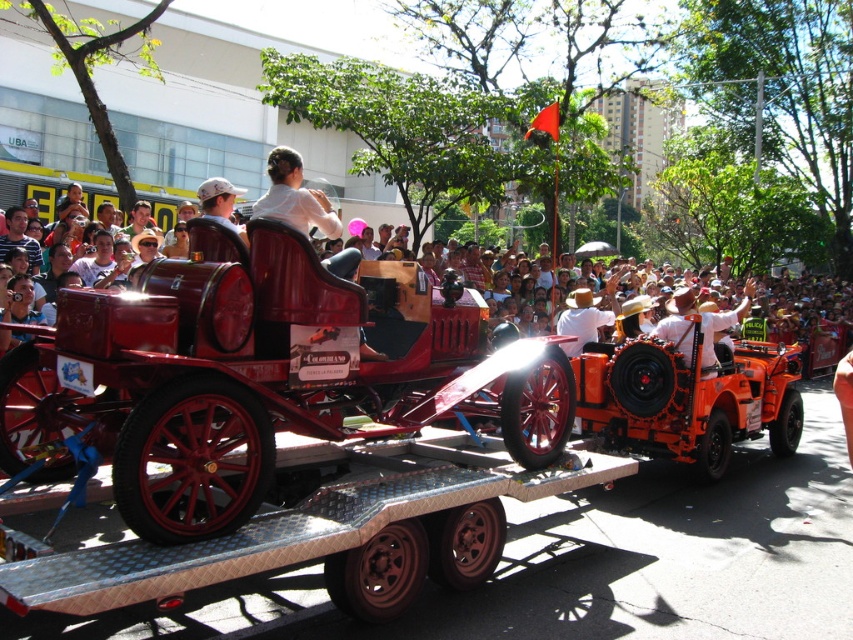
Question: Is white matte shirt at upper center bigger than orange fabric shirt at center?

Choices:
 (A) no
 (B) yes

Answer: (B)

Question: Which of the following is the closest to the observer?

Choices:
 (A) (753, 304)
 (B) (279, 218)
 (C) (724, 326)

Answer: (B)

Question: Does matte white crowd at center have a greater width compared to white matte shirt at upper center?

Choices:
 (A) no
 (B) yes

Answer: (B)

Question: Is white matte shirt at upper center further to camera compared to white straw hat at center?

Choices:
 (A) yes
 (B) no

Answer: (B)

Question: Among these points, which one is nearest to the camera?

Choices:
 (A) (583, 324)
 (B) (262, 204)
 (C) (728, 300)

Answer: (B)

Question: Estimate the real-world distances between objects in this image. Which object is farther from the matte white crowd at center?

Choices:
 (A) white matte shirt at upper center
 (B) white straw hat at center

Answer: (A)